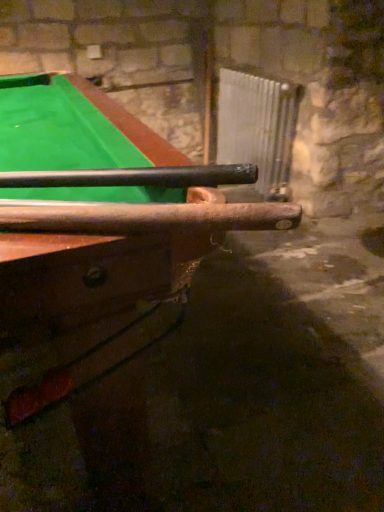
Find the location of a particular element. The width and height of the screenshot is (384, 512). white metallic radiator at upper center is located at coordinates (258, 127).

Measure the distance between white metallic radiator at upper center and camera.

white metallic radiator at upper center is 2.41 meters from camera.

Describe the element at coordinates (258, 127) in the screenshot. This screenshot has height=512, width=384. I see `white metallic radiator at upper center` at that location.

Locate an element on the screen. The width and height of the screenshot is (384, 512). white metallic radiator at upper center is located at coordinates (258, 127).